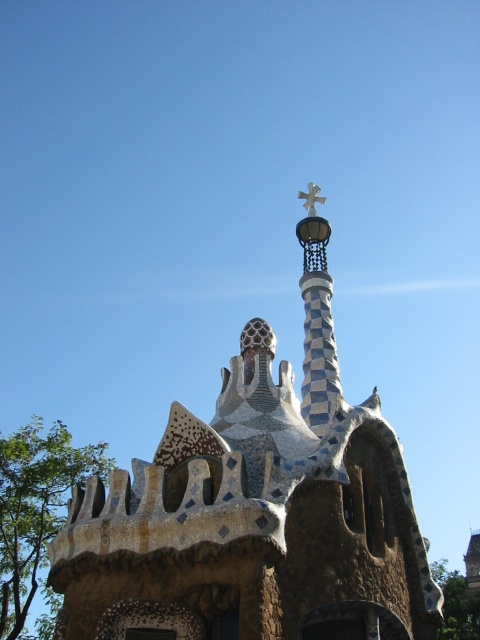
Does checkerboard mosaic spire at center have a smaller size compared to gold metallic cross at upper center?

Actually, checkerboard mosaic spire at center might be larger than gold metallic cross at upper center.

Is checkerboard mosaic spire at center bigger than gold metallic cross at upper center?

Indeed, checkerboard mosaic spire at center has a larger size compared to gold metallic cross at upper center.

Image resolution: width=480 pixels, height=640 pixels. What do you see at coordinates (316, 317) in the screenshot?
I see `checkerboard mosaic spire at center` at bounding box center [316, 317].

Identify the location of checkerboard mosaic spire at center. (316, 317).

Does mosaic tile church at center appear under gold metallic cross at upper center?

Yes.

Which of these two, mosaic tile church at center or gold metallic cross at upper center, stands shorter?

With less height is gold metallic cross at upper center.

The image size is (480, 640). Identify the location of mosaic tile church at center. (255, 509).

Find the location of a particular element. This screenshot has width=480, height=640. mosaic tile church at center is located at coordinates (255, 509).

You are a GUI agent. You are given a task and a screenshot of the screen. Output one action in this format:
    pyautogui.click(x=<x>, y=<y>)
    Task: Click on the mosaic tile church at center
    This screenshot has height=640, width=480.
    Given the screenshot: What is the action you would take?
    pyautogui.click(x=255, y=509)

From the picture: Measure the distance between mosaic tile church at center and camera.

mosaic tile church at center is 160.08 feet from camera.

Find the location of a particular element. Image resolution: width=480 pixels, height=640 pixels. mosaic tile church at center is located at coordinates [255, 509].